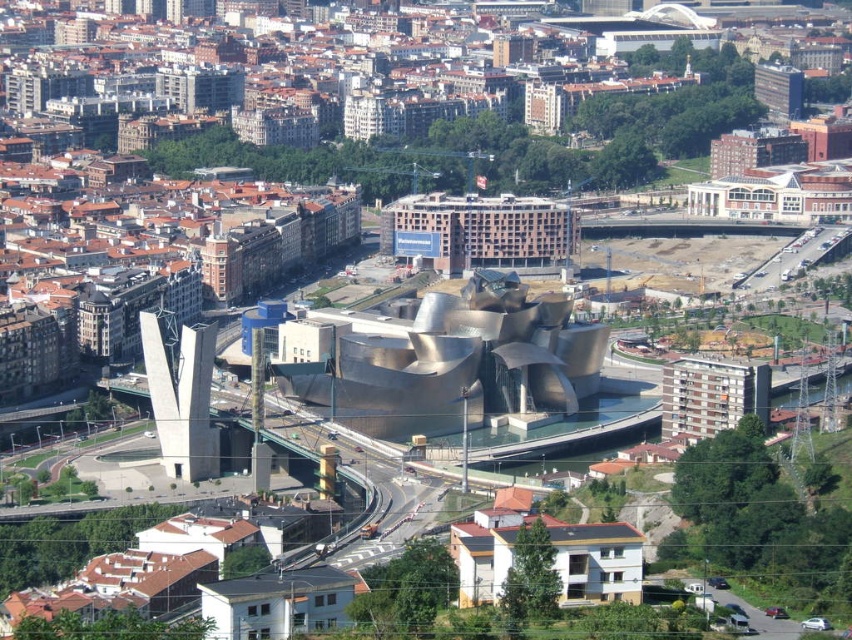
Looking at this image, is white painted concrete building at lower center thinner than white concrete building at center right?

No.

What do you see at coordinates (596, 560) in the screenshot?
I see `white painted concrete building at lower center` at bounding box center [596, 560].

Identify the location of white painted concrete building at lower center. This screenshot has width=852, height=640. (596, 560).

The image size is (852, 640). What are the coordinates of `brown brick building at center` in the screenshot? It's located at (479, 232).

Which is in front, point (488, 205) or point (753, 368)?

Positioned in front is point (753, 368).

Which is behind, point (450, 232) or point (712, 371)?

Point (450, 232)

I want to click on brown brick building at center, so click(x=479, y=232).

Is the position of metallic silver building at center more distant than that of brown brick building at center?

No, metallic silver building at center is in front of brown brick building at center.

Does metallic silver building at center appear on the right side of brown brick building at center?

In fact, metallic silver building at center is to the left of brown brick building at center.

Identify the location of metallic silver building at center. (456, 362).

Locate an element on the screen. metallic silver building at center is located at coordinates (456, 362).